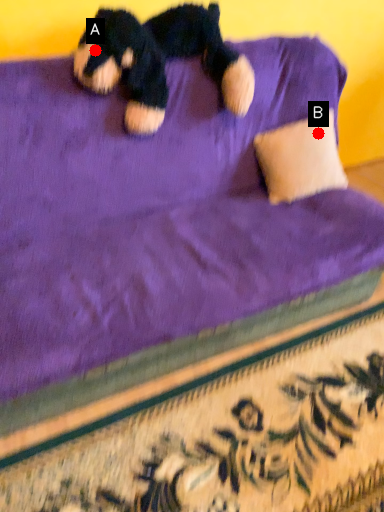
Question: Two points are circled on the image, labeled by A and B beside each circle. Among these points, which one is nearest to the camera?

Choices:
 (A) A is closer
 (B) B is closer

Answer: (A)